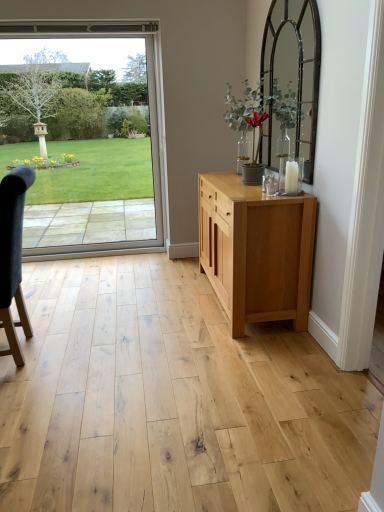
Question: Considering the relative sizes of natural wood cabinet at center and dark gray fabric chair at left in the image provided, is natural wood cabinet at center wider than dark gray fabric chair at left?

Choices:
 (A) yes
 (B) no

Answer: (A)

Question: Considering the relative sizes of natural wood cabinet at center and dark gray fabric chair at left in the image provided, is natural wood cabinet at center bigger than dark gray fabric chair at left?

Choices:
 (A) no
 (B) yes

Answer: (B)

Question: Considering the relative sizes of natural wood cabinet at center and dark gray fabric chair at left in the image provided, is natural wood cabinet at center taller than dark gray fabric chair at left?

Choices:
 (A) yes
 (B) no

Answer: (B)

Question: From a real-world perspective, is natural wood cabinet at center over dark gray fabric chair at left?

Choices:
 (A) yes
 (B) no

Answer: (B)

Question: Is natural wood cabinet at center closer to camera compared to dark gray fabric chair at left?

Choices:
 (A) no
 (B) yes

Answer: (A)

Question: From a real-world perspective, is natural wood cabinet at center above or below clear glass door at left?

Choices:
 (A) above
 (B) below

Answer: (B)

Question: From the image's perspective, is natural wood cabinet at center located above or below clear glass door at left?

Choices:
 (A) above
 (B) below

Answer: (B)

Question: Is natural wood cabinet at center in front of or behind clear glass door at left in the image?

Choices:
 (A) behind
 (B) front

Answer: (B)

Question: Would you say natural wood cabinet at center is to the left or to the right of clear glass door at left in the picture?

Choices:
 (A) right
 (B) left

Answer: (A)

Question: Is point (6, 266) closer or farther from the camera than point (238, 177)?

Choices:
 (A) farther
 (B) closer

Answer: (B)

Question: From a real-world perspective, is dark gray fabric chair at left positioned above or below natural wood cabinet at center?

Choices:
 (A) below
 (B) above

Answer: (B)

Question: Considering the positions of dark gray fabric chair at left and natural wood cabinet at center in the image, is dark gray fabric chair at left taller or shorter than natural wood cabinet at center?

Choices:
 (A) tall
 (B) short

Answer: (A)

Question: Looking at their shapes, would you say dark gray fabric chair at left is wider or thinner than natural wood cabinet at center?

Choices:
 (A) thin
 (B) wide

Answer: (A)

Question: In terms of size, does natural wood cabinet at center appear bigger or smaller than dark gray fabric chair at left?

Choices:
 (A) small
 (B) big

Answer: (B)

Question: Based on their positions, is natural wood cabinet at center located to the left or right of dark gray fabric chair at left?

Choices:
 (A) right
 (B) left

Answer: (A)